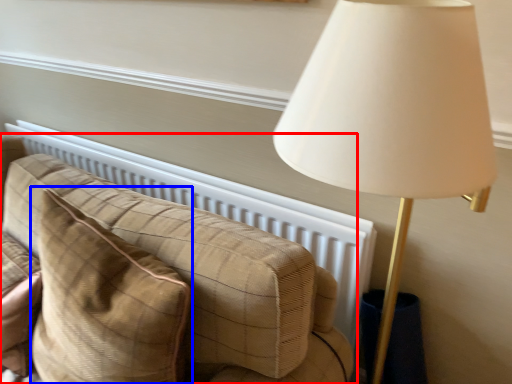
Question: Among these objects, which one is nearest to the camera, studio couch (highlighted by a red box) or throw pillow (highlighted by a blue box)?

Choices:
 (A) studio couch
 (B) throw pillow

Answer: (B)